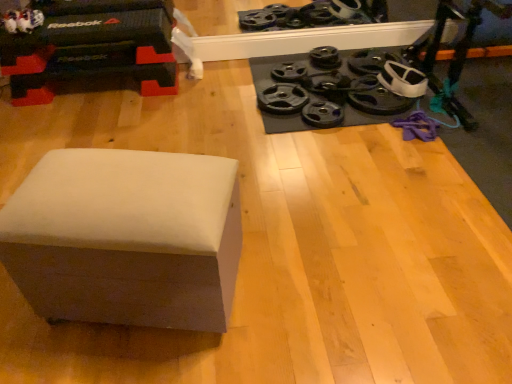
Question: Based on their sizes in the image, would you say black rubber weight plate at upper right, the 4th wheel when ordered from left to right, is bigger or smaller than black rubber weight plate at center-right, the 1th wheel positioned from the left?

Choices:
 (A) big
 (B) small

Answer: (B)

Question: In the image, is black rubber weight plate at upper right, acting as the 4th wheel starting from the right, on the left side or the right side of black rubber weight plate at center-right, placed as the seventh wheel when sorted from right to left?

Choices:
 (A) left
 (B) right

Answer: (B)

Question: Which is nearer to the black rubber weight plate at upper center, which ranks as the third wheel in right-to-left order?

Choices:
 (A) black rubber weight plate at upper right, which is counted as the 6th wheel, starting from the right
 (B) black rubber weight plate at center-right, placed as the seventh wheel when sorted from right to left
 (C) black rubber weight plate at upper right, the 6th wheel in the left-to-right sequence
 (D) black rubber weight plate at upper right, the 1th wheel positioned from the right
 (E) white matte ottoman at lower left

Answer: (D)

Question: Which of these objects is positioned farthest from the black rubber weight plate at upper right, positioned as the 7th wheel in left-to-right order?

Choices:
 (A) black rubber weight plate at upper right, the 4th wheel when ordered from left to right
 (B) black rubber weight plate at upper right, the 6th wheel in the left-to-right sequence
 (C) white matte ottoman at lower left
 (D) black rubber weight plate at upper right, acting as the 2th wheel starting from the left
 (E) black rubber weight plate at center-right, the 3th wheel positioned from the left

Answer: (C)